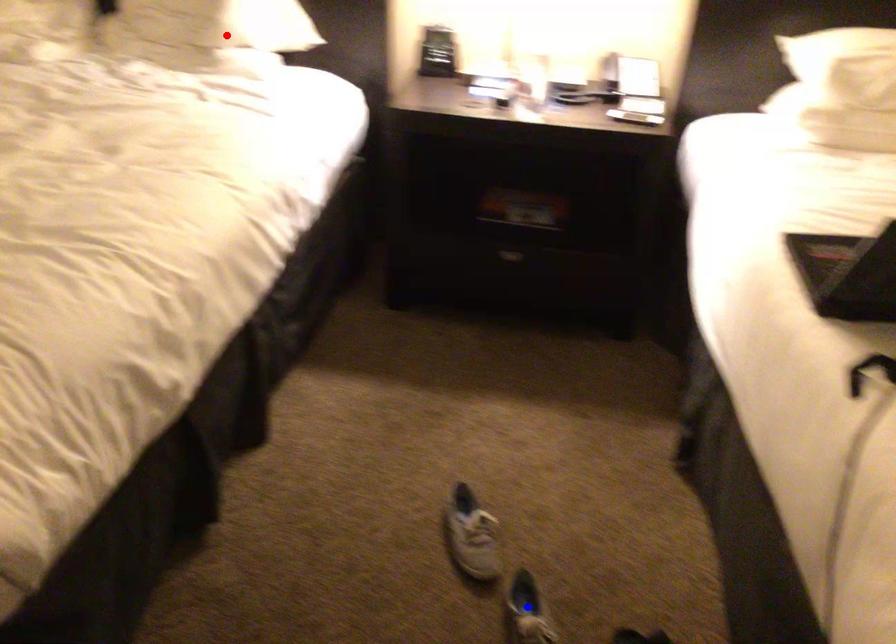
Question: Two points are marked on the image. Which point is closer to the camera?

Choices:
 (A) Blue point is closer.
 (B) Red point is closer.

Answer: (A)